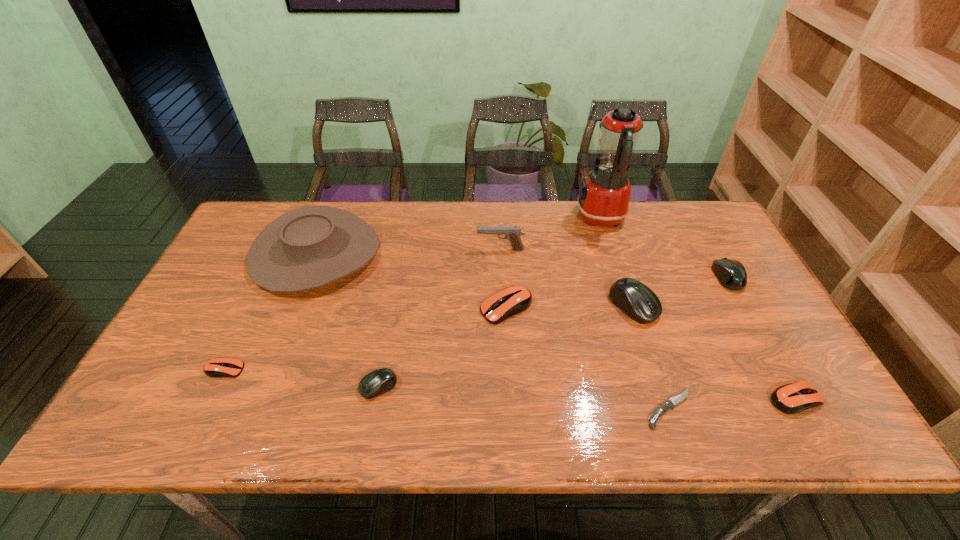
The height and width of the screenshot is (540, 960). What are the coordinates of `food processor that is at the far edge` in the screenshot? It's located at (603, 200).

Where is `cowboy hat situated at the far edge`? The image size is (960, 540). cowboy hat situated at the far edge is located at coordinates 307,248.

At what (x,y) coordinates should I click in order to perform the action: click on computer mouse positioned at the near edge. Please return your answer as a coordinate pair (x, y). The width and height of the screenshot is (960, 540). Looking at the image, I should click on (793, 398).

Image resolution: width=960 pixels, height=540 pixels. I want to click on pocketknife present at the near edge, so click(x=669, y=404).

Locate an element on the screen. cowboy hat present at the left edge is located at coordinates (307, 248).

Image resolution: width=960 pixels, height=540 pixels. Find the location of `computer mouse that is at the left edge`. computer mouse that is at the left edge is located at coordinates (217, 367).

Image resolution: width=960 pixels, height=540 pixels. In order to click on object that is at the far left corner in this screenshot , I will do `click(307, 248)`.

Locate an element on the screen. The height and width of the screenshot is (540, 960). object at the near right corner is located at coordinates (793, 398).

You are a GUI agent. You are given a task and a screenshot of the screen. Output one action in this format:
    pyautogui.click(x=<x>, y=<y>)
    Task: Click on the vacant space at the far edge of the desktop
    This screenshot has height=540, width=960.
    Given the screenshot: What is the action you would take?
    pyautogui.click(x=575, y=206)

In the image, there is a desktop. Identify the location of vacant space at the near edge. This screenshot has width=960, height=540. (479, 409).